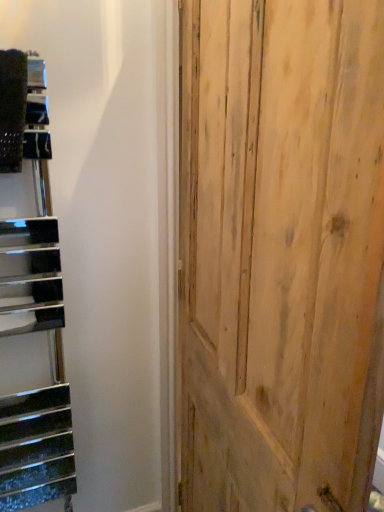
Question: Is point (271, 150) closer or farther from the camera than point (44, 334)?

Choices:
 (A) farther
 (B) closer

Answer: (B)

Question: Choose the correct answer: Is natural wood door at center inside metallic black stairwell at left or outside it?

Choices:
 (A) outside
 (B) inside

Answer: (A)

Question: From a real-world perspective, is natural wood door at center above or below metallic black stairwell at left?

Choices:
 (A) above
 (B) below

Answer: (B)

Question: From the image's perspective, relative to natural wood door at center, is metallic black stairwell at left above or below?

Choices:
 (A) above
 (B) below

Answer: (A)

Question: Is metallic black stairwell at left taller or shorter than natural wood door at center?

Choices:
 (A) tall
 (B) short

Answer: (B)

Question: Is point (39, 140) closer or farther from the camera than point (256, 352)?

Choices:
 (A) farther
 (B) closer

Answer: (A)

Question: In terms of width, does metallic black stairwell at left look wider or thinner when compared to natural wood door at center?

Choices:
 (A) thin
 (B) wide

Answer: (A)